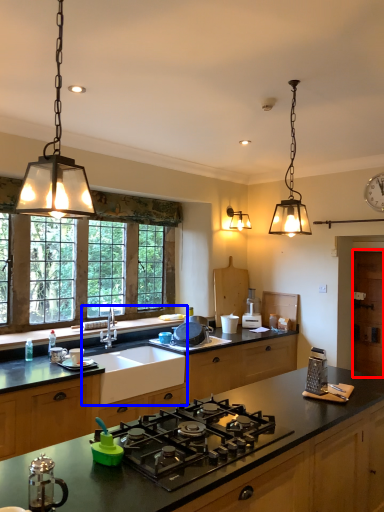
Question: Which object appears farthest to the camera in this image, cabinetry (highlighted by a red box) or sink (highlighted by a blue box)?

Choices:
 (A) cabinetry
 (B) sink

Answer: (A)